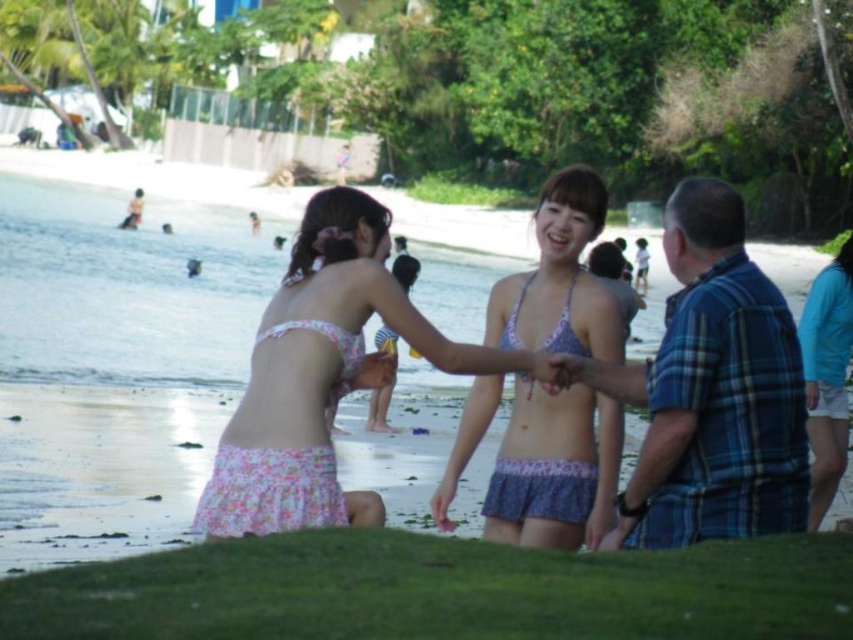
You are a fashion designer observing the beach scene. You need to create a swimsuit that fits the same size as the floral fabric bikini top at center and the light blue fabric shorts at lower right. Which swimsuit part requires more fabric in terms of width?

The floral fabric bikini top at center requires more fabric in terms of width because it might be wider than the light blue fabric shorts at lower right.

You are a photographer trying to capture a clear shot of both the floral fabric bikini top at center and the pink floral bikini at center. Since you want both subjects to be in focus, you need to know their positions relative to each other. Which one is closer to the camera?

The floral fabric bikini top at center is in front of the pink floral bikini at center, so it is closer to the camera.

You are a photographer standing at the edge of the beach. You want to take a photo of both the floral fabric bikini top at center and the pink floral bikini at center in the same frame. The camera you are using has a maximum focus range of 3 meters. Can you capture both objects in focus without moving your position?

The floral fabric bikini top at center and pink floral bikini at center are 2.87 meters apart. Since the distance between them is within the camera maximum focus range of 3 meters, you can capture both objects in focus without moving your position.